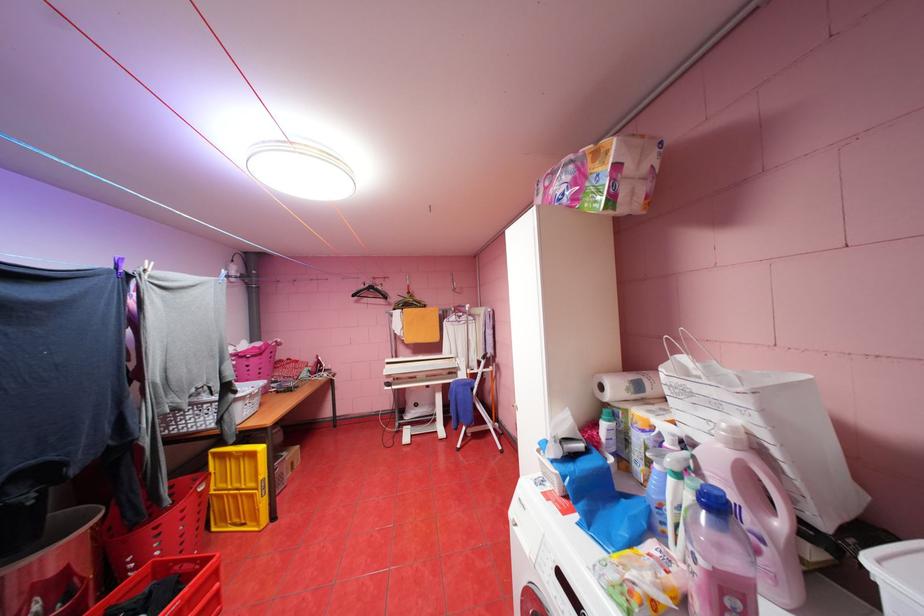
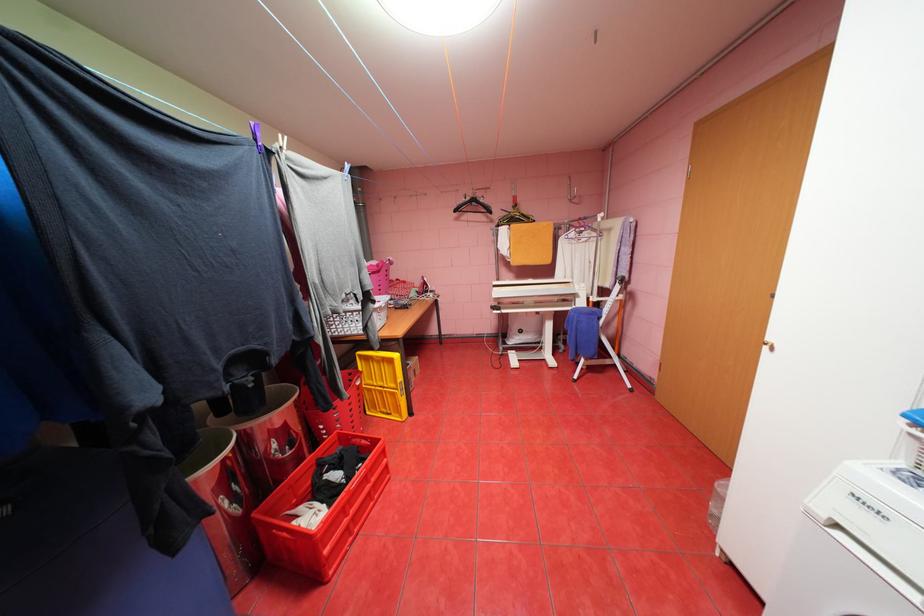
The point at [224,454] is marked in the first image. Where is the corresponding point in the second image?

(370, 355)